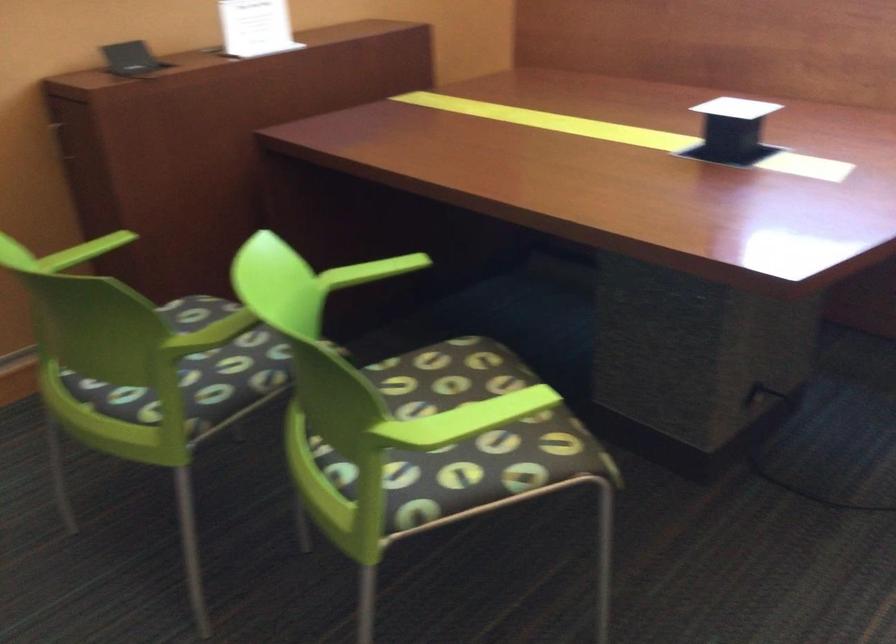
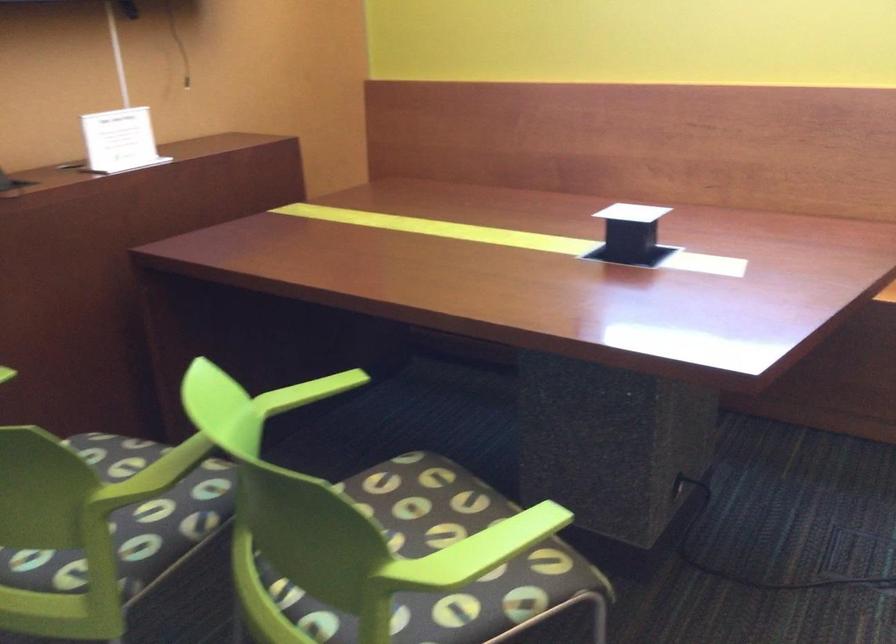
In the second image, find the point that corresponds to the point at 467,422 in the first image.

(476, 552)